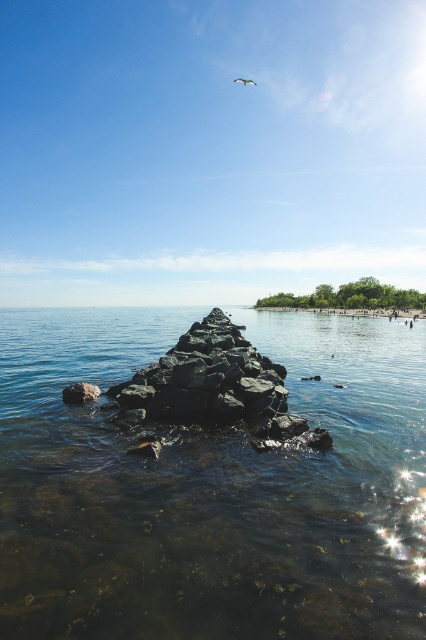
Question: Which point is closer to the camera?

Choices:
 (A) (66, 394)
 (B) (23, 332)

Answer: (A)

Question: Is clear water at center wider than gray rough rock at lower left?

Choices:
 (A) yes
 (B) no

Answer: (A)

Question: Can you confirm if gray rough rock at lower left is positioned to the left of white feathered bird at upper center?

Choices:
 (A) no
 (B) yes

Answer: (B)

Question: Considering the real-world distances, which object is farthest from the clear water at center?

Choices:
 (A) gray rough rock at lower left
 (B) white feathered bird at upper center

Answer: (B)

Question: Is clear water at center thinner than white feathered bird at upper center?

Choices:
 (A) no
 (B) yes

Answer: (A)

Question: Which object is closer to the camera taking this photo?

Choices:
 (A) white feathered bird at upper center
 (B) clear water at center

Answer: (B)